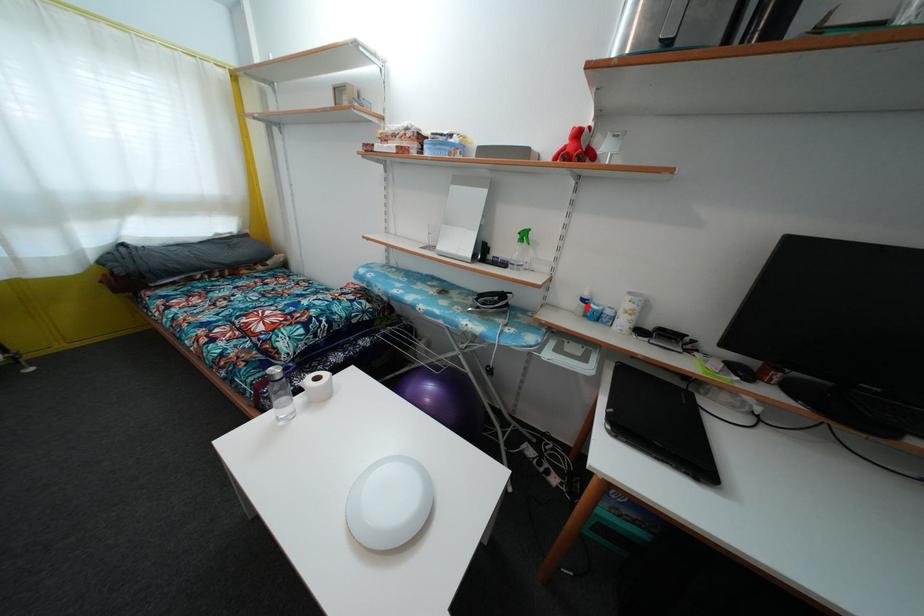
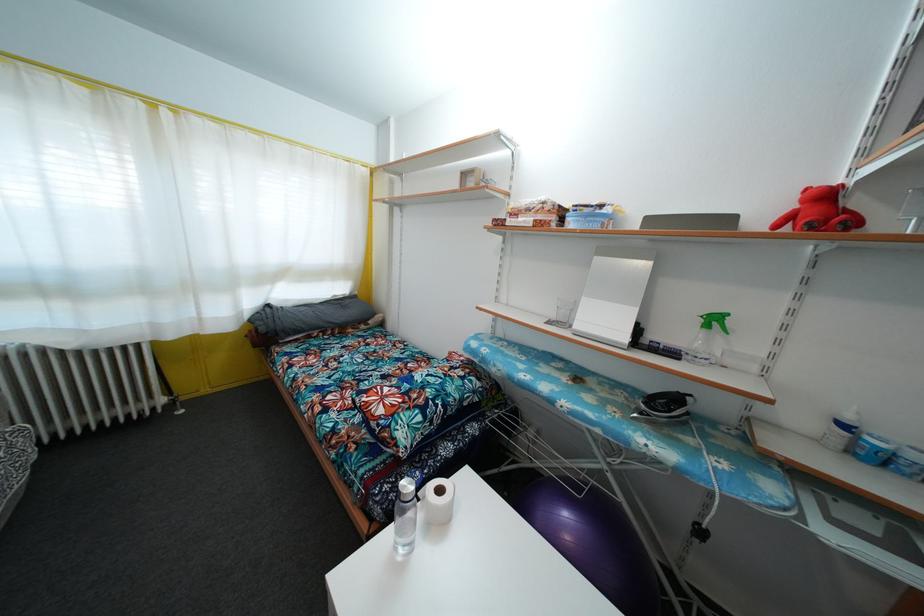
Where in the second image is the point corresponding to the highlighted location from the first image?

(848, 432)